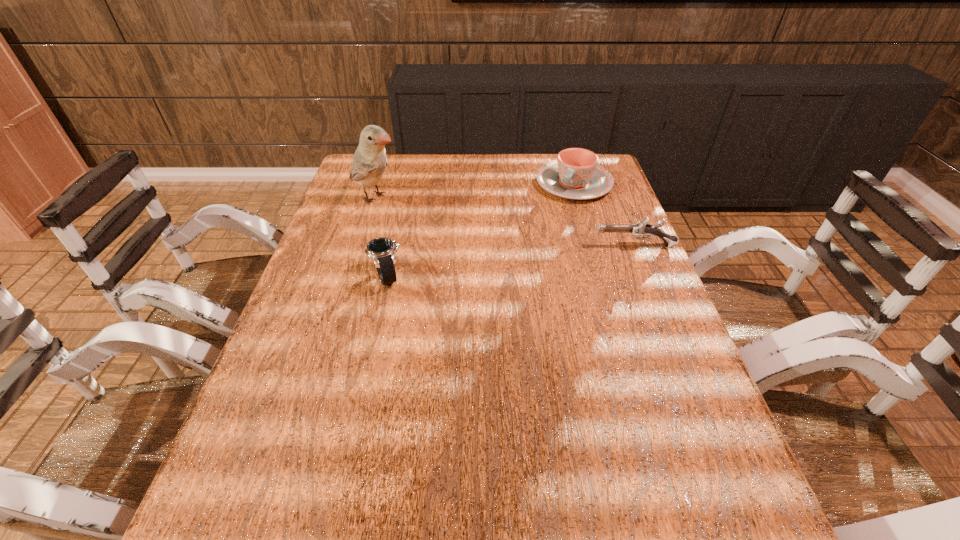
The width and height of the screenshot is (960, 540). I want to click on watch, so click(x=382, y=250).

Locate an element on the screen. The image size is (960, 540). the second nearest object is located at coordinates (641, 228).

Where is `chinaware`? The width and height of the screenshot is (960, 540). chinaware is located at coordinates (576, 175).

Find the location of a particular element. bird is located at coordinates (369, 162).

Find the location of a particular element. This screenshot has width=960, height=540. free space located 0.250m on the right of the nearest object is located at coordinates (500, 278).

At what (x,y) coordinates should I click in order to perform the action: click on blank space located aimed along the barrel of the gun. Please return your answer as a coordinate pair (x, y). This screenshot has width=960, height=540. Looking at the image, I should click on (468, 246).

The height and width of the screenshot is (540, 960). I want to click on free spot located 0.220m aimed along the barrel of the gun, so click(515, 246).

Where is `vacant point located 0.300m aimed along the barrel of the gun`? The image size is (960, 540). vacant point located 0.300m aimed along the barrel of the gun is located at coordinates coord(487,246).

This screenshot has height=540, width=960. What are the coordinates of `free location located on the handle side of the chinaware` in the screenshot? It's located at (551, 219).

You are a GUI agent. You are given a task and a screenshot of the screen. Output one action in this format:
    pyautogui.click(x=<x>, y=<y>)
    Task: Click on the free location located 0.240m on the handle side of the chinaware
    Image resolution: width=960 pixels, height=540 pixels.
    Given the screenshot: What is the action you would take?
    pyautogui.click(x=534, y=246)